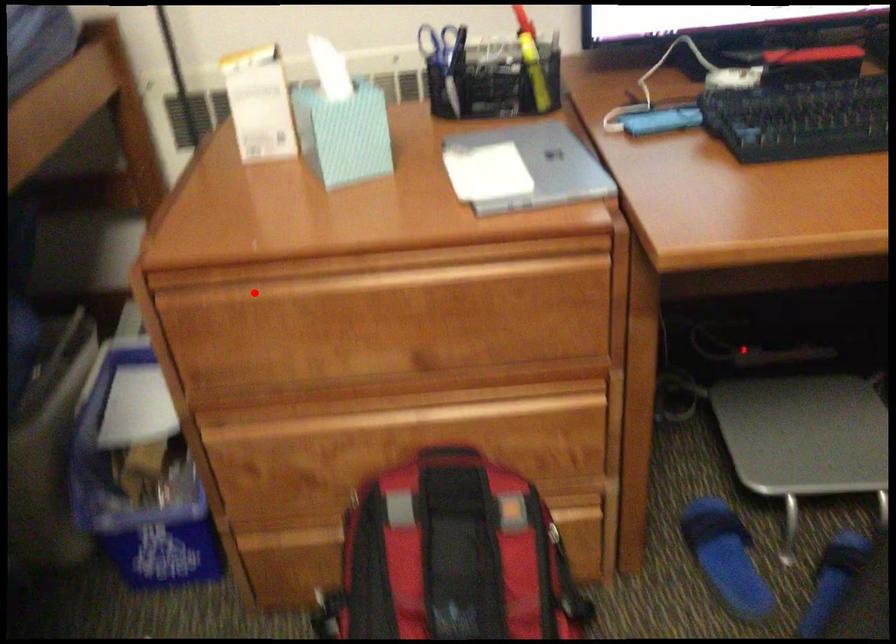
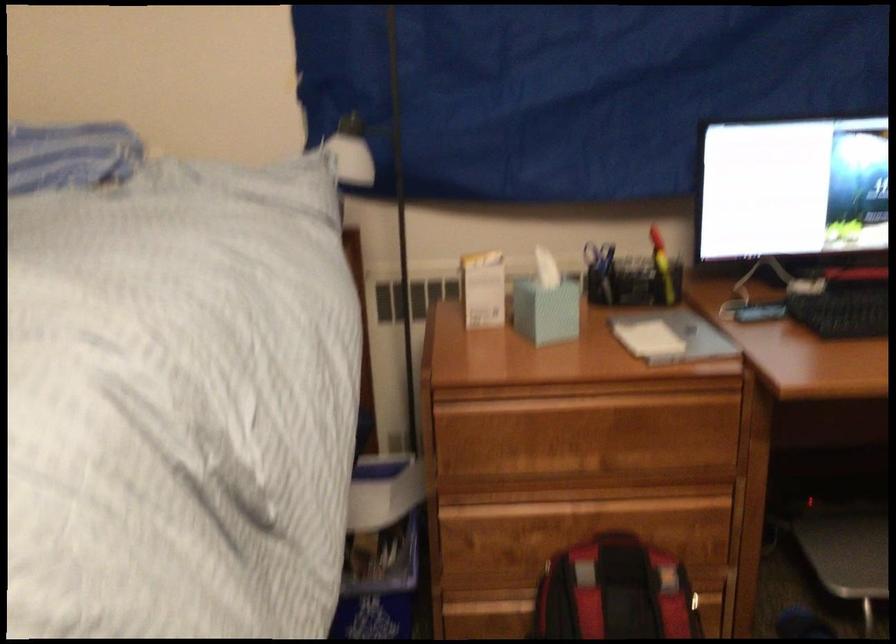
Question: I am providing you with two images of the same scene from different viewpoints. A red point is shown in image1. For the corresponding object point in image2, is it positioned nearer or farther from the camera?

Choices:
 (A) Nearer
 (B) Farther

Answer: (B)